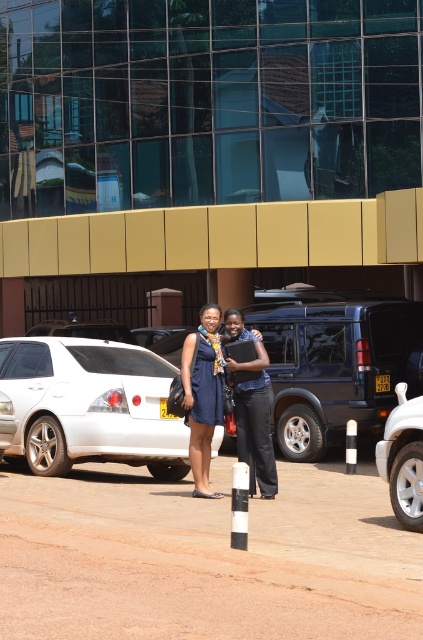
Question: Observing the image, what is the correct spatial positioning of brown dirt track at center in reference to white glossy sedan at center?

Choices:
 (A) below
 (B) above

Answer: (A)

Question: Is blue satin dress at center to the left of white matte car at lower right from the viewer's perspective?

Choices:
 (A) yes
 (B) no

Answer: (A)

Question: In this image, where is brown dirt track at center located relative to blue satin dress at center?

Choices:
 (A) left
 (B) right

Answer: (B)

Question: Which of the following is the farthest from the observer?

Choices:
 (A) white glossy sedan at center
 (B) blue satin dress at center
 (C) white matte car at lower right
 (D) brown dirt track at center

Answer: (A)

Question: Which is farther from the white glossy sedan at center?

Choices:
 (A) white matte car at lower right
 (B) blue satin dress at center
 (C) metallic blue suv at center
 (D) brown dirt track at center

Answer: (A)

Question: Which point is closer to the camera taking this photo?

Choices:
 (A) (184, 355)
 (B) (57, 413)
 (C) (409, 406)

Answer: (C)